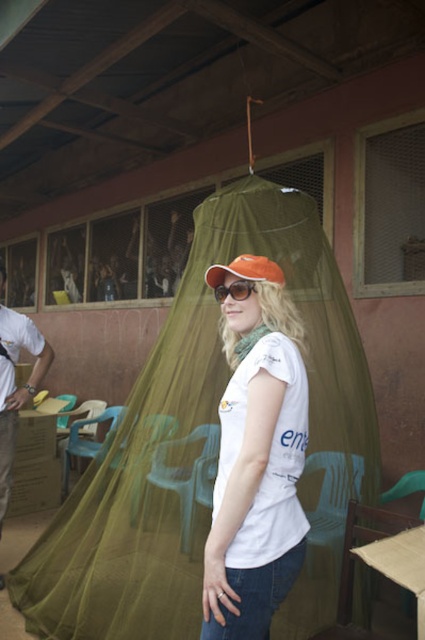
In the scene shown: Can you confirm if white matte t-shirt at center is positioned above sunglassestransparent at center?

Incorrect, white matte t-shirt at center is not positioned above sunglassestransparent at center.

The image size is (425, 640). What do you see at coordinates (257, 456) in the screenshot? I see `white matte t-shirt at center` at bounding box center [257, 456].

Locate an element on the screen. This screenshot has width=425, height=640. white matte t-shirt at center is located at coordinates (257, 456).

Based on the photo, how far apart are white cardboard box at left and sunglassestransparent at center?

2.21 meters

Looking at this image, can you confirm if white cardboard box at left is smaller than sunglassestransparent at center?

Actually, white cardboard box at left might be larger than sunglassestransparent at center.

This screenshot has width=425, height=640. What do you see at coordinates (14, 381) in the screenshot?
I see `white cardboard box at left` at bounding box center [14, 381].

Identify the location of white cardboard box at left. click(14, 381).

Is orange fabric cap at center to the right of sunglassestransparent at center from the viewer's perspective?

Yes, orange fabric cap at center is to the right of sunglassestransparent at center.

Does orange fabric cap at center lie behind sunglassestransparent at center?

No, orange fabric cap at center is closer to the viewer.

What do you see at coordinates (246, 269) in the screenshot? I see `orange fabric cap at center` at bounding box center [246, 269].

The image size is (425, 640). In order to click on orange fabric cap at center in this screenshot , I will do `click(246, 269)`.